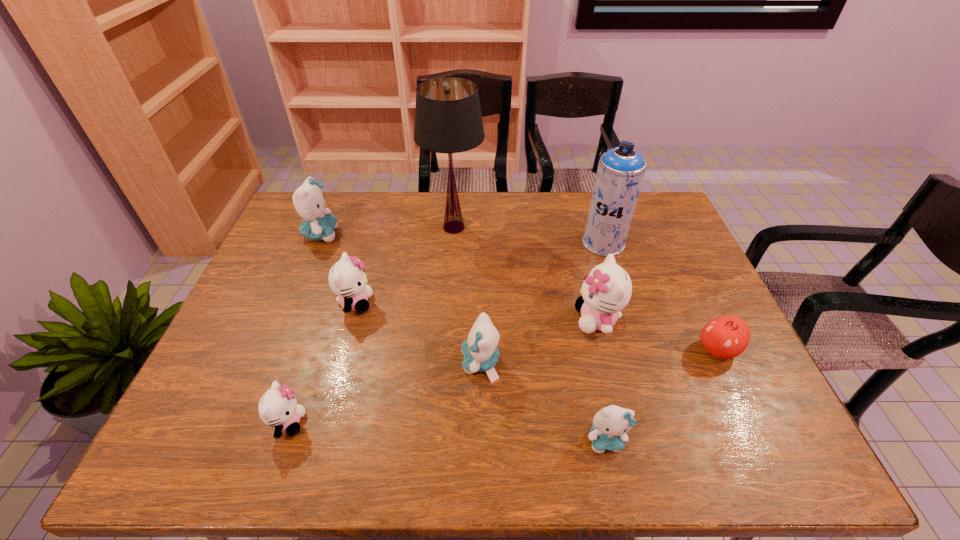
The image size is (960, 540). Find the location of `lampshade`. lampshade is located at coordinates (448, 119).

The width and height of the screenshot is (960, 540). Identify the location of blue aerosol can. (620, 173).

Locate an element on the screen. This screenshot has width=960, height=540. aerosol can is located at coordinates (620, 173).

The image size is (960, 540). In order to click on the leftmost blue kitten in this screenshot , I will do `click(309, 202)`.

Locate an element on the screen. The height and width of the screenshot is (540, 960). the leftmost kitten is located at coordinates (309, 202).

The height and width of the screenshot is (540, 960). I want to click on the rightmost white kitten, so click(x=607, y=289).

This screenshot has width=960, height=540. Identify the location of the third kitten from right to left. (480, 351).

Identify the location of the second biggest blue kitten. (480, 351).

Where is `the second smallest white kitten`? The image size is (960, 540). the second smallest white kitten is located at coordinates (347, 279).

At what (x,y) coordinates should I click in order to perform the action: click on the rightmost object. Please return your answer as a coordinate pair (x, y). Looking at the image, I should click on (726, 337).